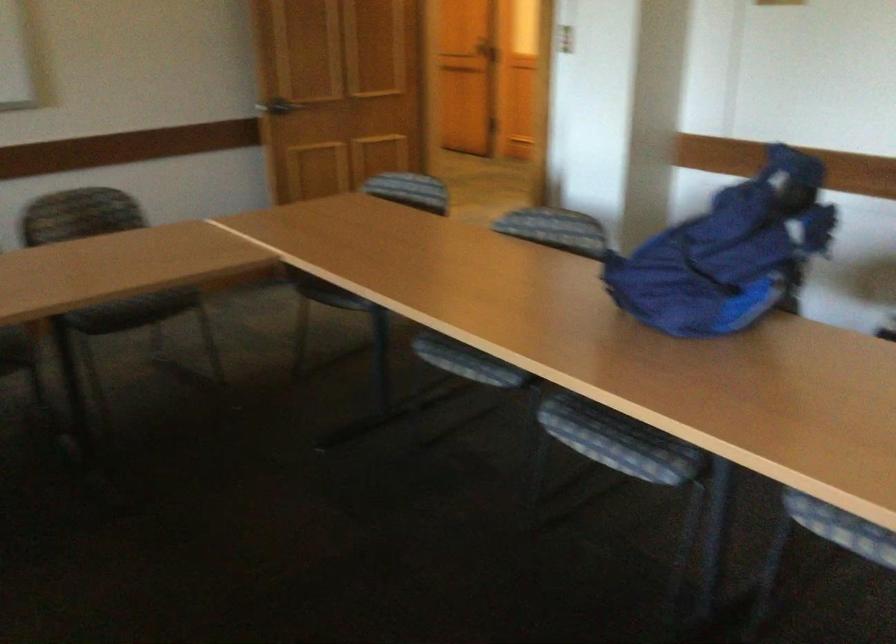
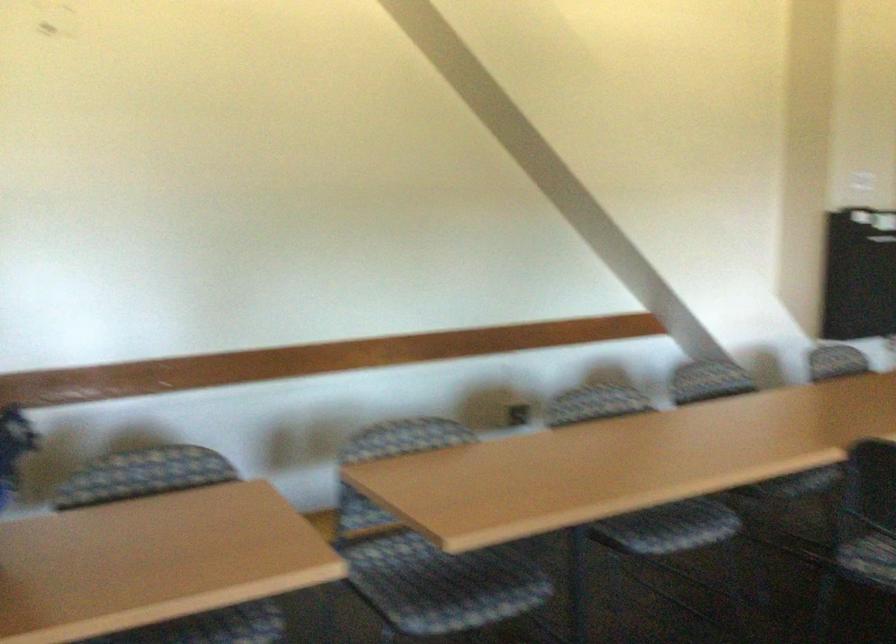
Question: The images are taken continuously from a first-person perspective. In which direction is your viewpoint rotating?

Choices:
 (A) Left
 (B) Right
 (C) Up
 (D) Down

Answer: (B)